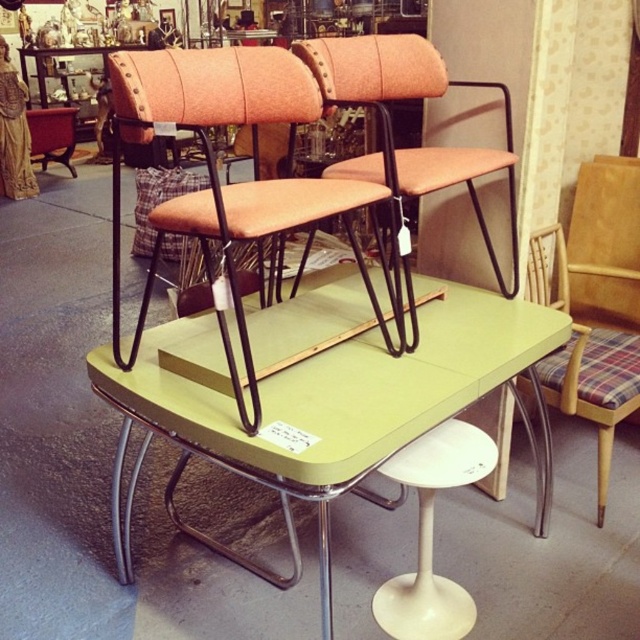
You are arranging a small dinner party and need to know if there is enough space between the orange fabric chair at center and the white plastic stool at lower center to comfortably move around. The minimum space required for comfortable movement is 60 centimeters. Can you fit through the space between them?

The distance between the orange fabric chair at center and the white plastic stool at lower center is 59.60 centimeters, which is slightly less than the required 60 centimeters. Therefore, it might be tight but technically possible to move through the space, though not ideally comfortable.

You are a customer in a furniture store and want to place a rectangular coffee table between the plaid fabric folding chair at right and the white plastic stool at lower center. The coffee table you have in mind is 36 inches long. Can you fit it in the space between them?

The distance between the plaid fabric folding chair at right and the white plastic stool at lower center is 34.52 inches. Since the coffee table is 36 inches long, which is longer than the available space, it won